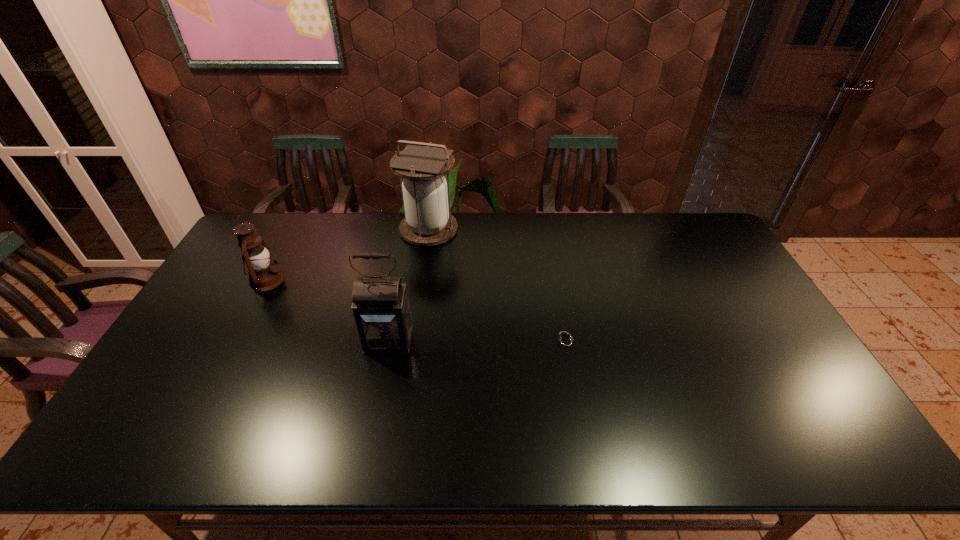
This screenshot has width=960, height=540. I want to click on free space located on the face of the shortest object, so click(460, 342).

The width and height of the screenshot is (960, 540). What are the coordinates of `free space located on the face of the shortest object` in the screenshot? It's located at (463, 342).

Image resolution: width=960 pixels, height=540 pixels. I want to click on object present at the far edge, so click(428, 222).

The width and height of the screenshot is (960, 540). I want to click on object that is at the left edge, so click(x=263, y=275).

In the image, there is a desktop. Where is `vacant area at the far edge`? Image resolution: width=960 pixels, height=540 pixels. vacant area at the far edge is located at coordinates (588, 232).

Locate an element on the screen. vacant space at the left edge of the desktop is located at coordinates (249, 279).

Where is `vacant space at the right edge of the desktop`? vacant space at the right edge of the desktop is located at coordinates (703, 272).

Locate an element on the screen. The image size is (960, 540). free space at the far left corner of the desktop is located at coordinates (289, 217).

Find the location of a particular element. The height and width of the screenshot is (540, 960). free space between the rightmost object and the shortest lantern is located at coordinates (417, 311).

You are a GUI agent. You are given a task and a screenshot of the screen. Output one action in this format:
    pyautogui.click(x=<x>, y=<y>)
    Task: Click on the vacant area that lies between the farthest object and the leftmost object
    
    Given the screenshot: What is the action you would take?
    pyautogui.click(x=348, y=254)